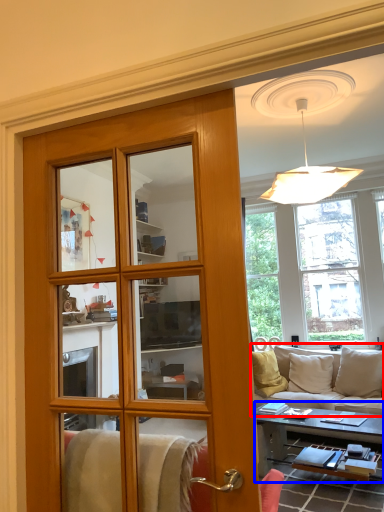
Question: Among these objects, which one is nearest to the camera, studio couch (highlighted by a red box) or table (highlighted by a blue box)?

Choices:
 (A) studio couch
 (B) table

Answer: (B)